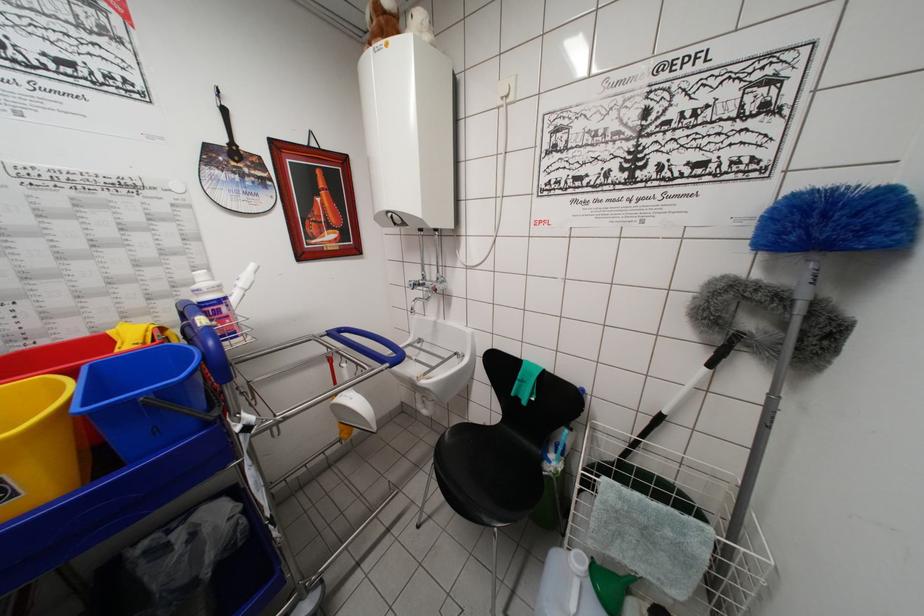
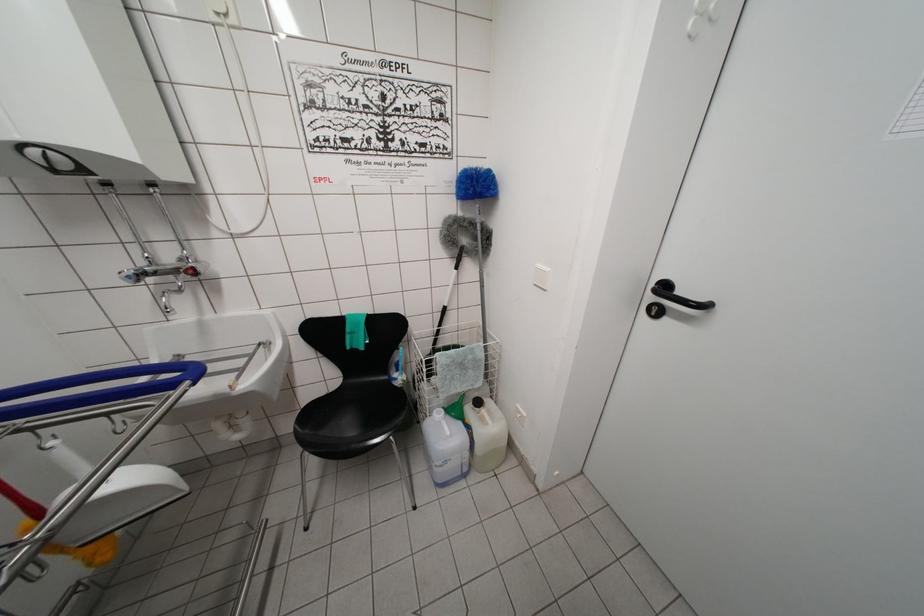
In the second image, find the point that corresponds to point (576, 557) in the first image.

(438, 418)